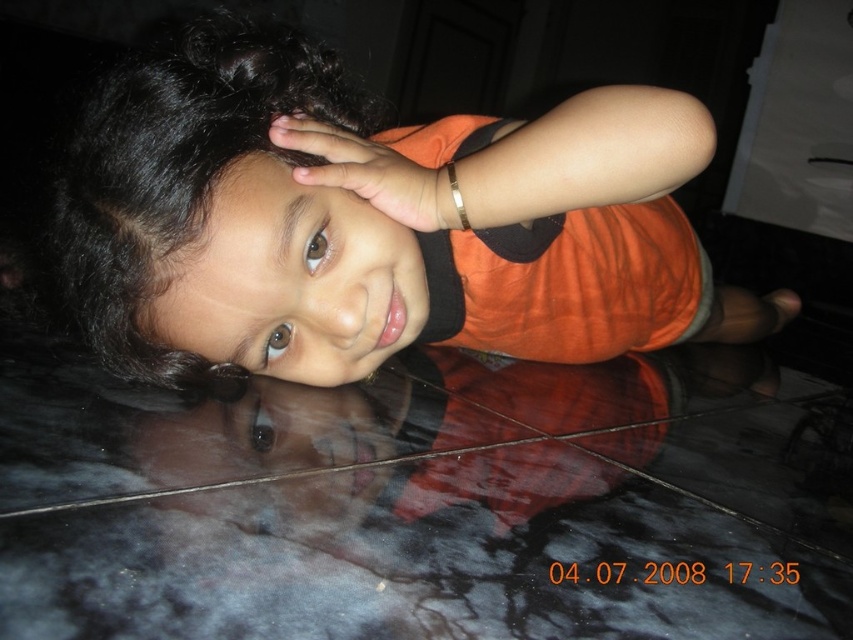
Is point (126, 342) positioned after point (277, 156)?

Yes, point (126, 342) is behind point (277, 156).

Can you confirm if black curly hair at center is positioned to the left of smooth skin face at center?

Correct, you'll find black curly hair at center to the left of smooth skin face at center.

The height and width of the screenshot is (640, 853). Identify the location of black curly hair at center. (225, 218).

What do you see at coordinates (368, 172) in the screenshot?
I see `matte orange hand at upper center` at bounding box center [368, 172].

Does matte orange hand at upper center appear on the right side of gold metallic bracelet at upper center?

In fact, matte orange hand at upper center is to the left of gold metallic bracelet at upper center.

This screenshot has height=640, width=853. What are the coordinates of `matte orange hand at upper center` in the screenshot? It's located at (368, 172).

Locate an element on the screen. Image resolution: width=853 pixels, height=640 pixels. matte orange hand at upper center is located at coordinates (368, 172).

Between point (223, 326) and point (369, 193), which one is positioned behind?

Positioned behind is point (369, 193).

Which of these two, smooth skin face at center or matte orange hand at upper center, stands shorter?

With less height is matte orange hand at upper center.

What do you see at coordinates (289, 280) in the screenshot? The image size is (853, 640). I see `smooth skin face at center` at bounding box center [289, 280].

Identify the location of smooth skin face at center. The width and height of the screenshot is (853, 640). (289, 280).